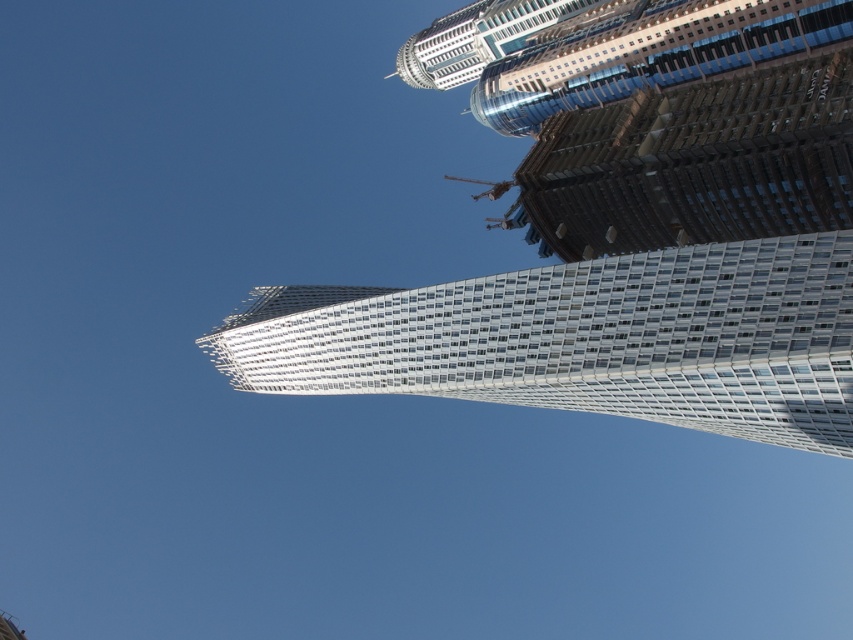
You are an architect analyzing the skyline composition. Given the coordinates provided, which building at point (585, 339) is the white glass building at center located? Please specify its position relative to other buildings in the scene.

The white glass building at center is located at point (585, 339), which is the central position in the skyline. It is surrounded by other high rises, with the circular top building to its left and the rectangular glass building to its right.

You are an architect designing a new park between the white glass building at center and the metallic glass skyscraper at upper center. To ensure the park is accessible from both buildings, you need to know which building has a wider base. Which building has a wider base?

The white glass building at center might be wider than metallic glass skyscraper at upper center, so it likely has a wider base.

You are an architect reviewing a cityscape design. You notice the white glass building at center and the metallic glass skyscraper at upper center. Which of these two structures is located to the right of the other?

The white glass building at center is positioned on the right side of the metallic glass skyscraper at upper center.